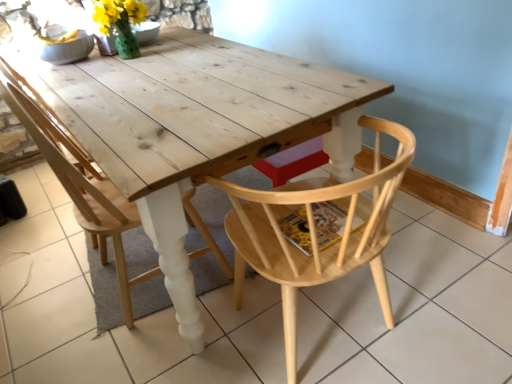
Question: Which direction should I rotate to face natural wood chair at center, which is counted as the 2th chair, starting from the right, — up or down?

Choices:
 (A) down
 (B) up

Answer: (B)

Question: Could you tell me if natural wood chair at center, which is counted as the 2th chair, starting from the right, is facing natural wood table at center?

Choices:
 (A) no
 (B) yes

Answer: (B)

Question: Considering the relative sizes of natural wood chair at center, arranged as the 1th chair when viewed from the left, and natural wood table at center in the image provided, is natural wood chair at center, arranged as the 1th chair when viewed from the left, smaller than natural wood table at center?

Choices:
 (A) no
 (B) yes

Answer: (B)

Question: From a real-world perspective, is natural wood chair at center, arranged as the 1th chair when viewed from the left, positioned under natural wood table at center based on gravity?

Choices:
 (A) yes
 (B) no

Answer: (B)

Question: From a real-world perspective, is natural wood chair at center, which is counted as the 2th chair, starting from the right, on natural wood table at center?

Choices:
 (A) yes
 (B) no

Answer: (A)

Question: Is natural wood chair at center, arranged as the 1th chair when viewed from the left, shorter than natural wood table at center?

Choices:
 (A) yes
 (B) no

Answer: (B)

Question: Considering the relative sizes of natural wood chair at center, which is counted as the 2th chair, starting from the right, and natural wood table at center in the image provided, is natural wood chair at center, which is counted as the 2th chair, starting from the right, taller than natural wood table at center?

Choices:
 (A) no
 (B) yes

Answer: (B)

Question: Is natural wood chair at center, which is counted as the 2th chair, starting from the right, smaller than natural wood chair at center, the 1th chair from the right?

Choices:
 (A) yes
 (B) no

Answer: (B)

Question: Is natural wood chair at center, arranged as the 1th chair when viewed from the left, at the right side of natural wood chair at center, the 1th chair from the right?

Choices:
 (A) no
 (B) yes

Answer: (A)

Question: Is natural wood chair at center, which is counted as the 2th chair, starting from the right, shorter than natural wood chair at center, the 1th chair from the right?

Choices:
 (A) yes
 (B) no

Answer: (B)

Question: From the image's perspective, is natural wood chair at center, arranged as the 1th chair when viewed from the left, below natural wood chair at center, the 2th chair positioned from the left?

Choices:
 (A) yes
 (B) no

Answer: (B)

Question: Can you confirm if natural wood chair at center, arranged as the 1th chair when viewed from the left, is bigger than natural wood chair at center, the 2th chair positioned from the left?

Choices:
 (A) no
 (B) yes

Answer: (B)

Question: Does natural wood chair at center, arranged as the 1th chair when viewed from the left, have a lesser width compared to natural wood chair at center, the 2th chair positioned from the left?

Choices:
 (A) no
 (B) yes

Answer: (B)

Question: Is natural wood table at center shorter than natural wood chair at center, the 1th chair from the right?

Choices:
 (A) no
 (B) yes

Answer: (B)